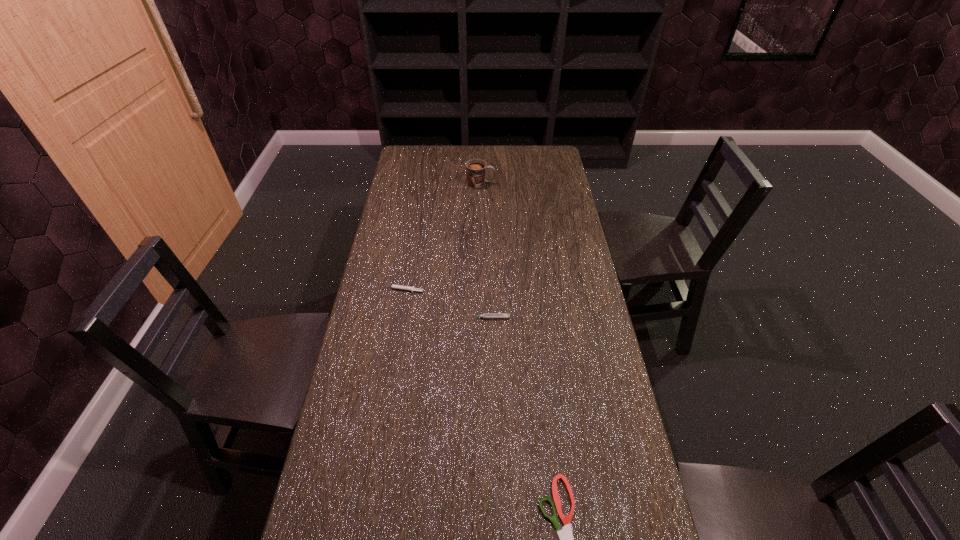
Image resolution: width=960 pixels, height=540 pixels. In order to click on free space located on the right of the shorter syringe in this screenshot , I will do coord(450,290).

The image size is (960, 540). What are the coordinates of `object at the left edge` in the screenshot? It's located at (400, 287).

Find the location of a particular element. Image resolution: width=960 pixels, height=540 pixels. vacant space at the far edge of the desktop is located at coordinates (515, 150).

This screenshot has height=540, width=960. Find the location of `vacant space at the left edge of the desktop`. vacant space at the left edge of the desktop is located at coordinates (388, 214).

At what (x,y) coordinates should I click in order to perform the action: click on vacant space at the right edge. Please return your answer as a coordinate pair (x, y). Looking at the image, I should click on (604, 352).

Locate an element on the screen. This screenshot has width=960, height=540. vacant area at the far left corner is located at coordinates (414, 166).

Identify the location of vacant space at the far right corner of the desktop. The width and height of the screenshot is (960, 540). (551, 161).

This screenshot has height=540, width=960. I want to click on free space between the leftmost object and the mug, so click(442, 237).

The image size is (960, 540). What are the coordinates of `empty location between the third shortest object and the third nearest object` in the screenshot? It's located at click(x=445, y=304).

The image size is (960, 540). What are the coordinates of `free spot between the second nearest object and the farther syringe` in the screenshot? It's located at (445, 304).